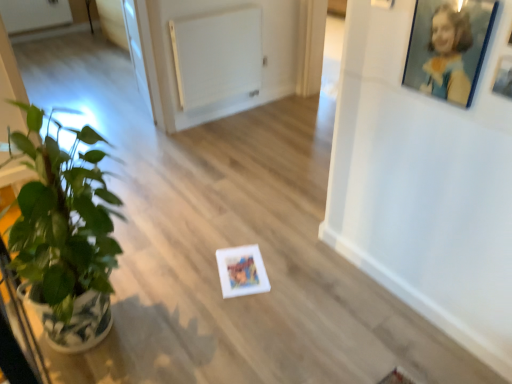
Find the location of a particular element. The image size is (512, 384). vacant space behind green glossy houseplant at left is located at coordinates (153, 246).